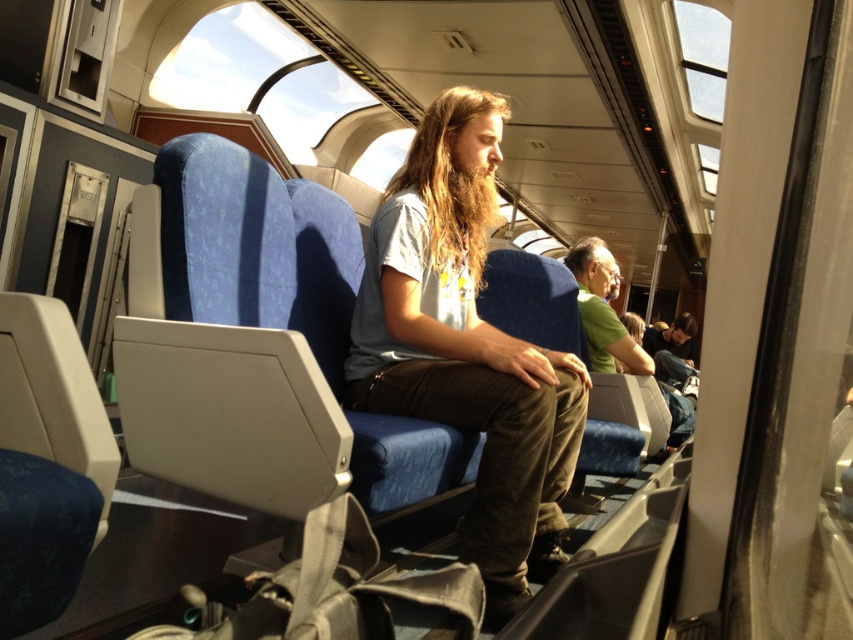
Question: Which of the following is the farthest from the observer?

Choices:
 (A) green matte shirt at center
 (B) matte gray shirt at center

Answer: (A)

Question: Is matte gray shirt at center to the right of green matte shirt at center from the viewer's perspective?

Choices:
 (A) no
 (B) yes

Answer: (A)

Question: Which of the following is the farthest from the observer?

Choices:
 (A) (440, 218)
 (B) (587, 284)

Answer: (B)

Question: Is matte gray shirt at center in front of green matte shirt at center?

Choices:
 (A) no
 (B) yes

Answer: (B)

Question: Which of the following is the closest to the observer?

Choices:
 (A) (672, 449)
 (B) (553, 524)

Answer: (B)

Question: Considering the relative positions of matte gray shirt at center and green matte shirt at center in the image provided, where is matte gray shirt at center located with respect to green matte shirt at center?

Choices:
 (A) below
 (B) above

Answer: (A)